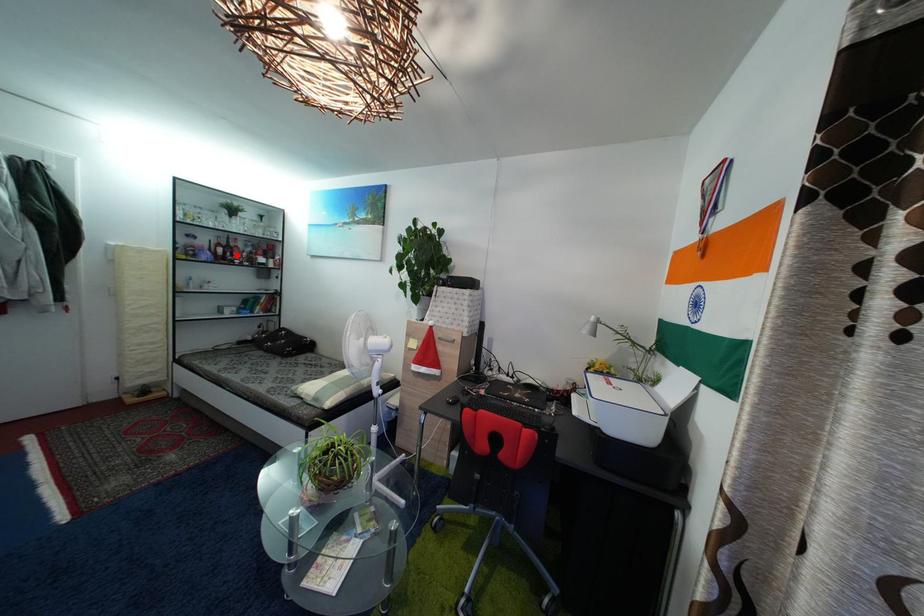
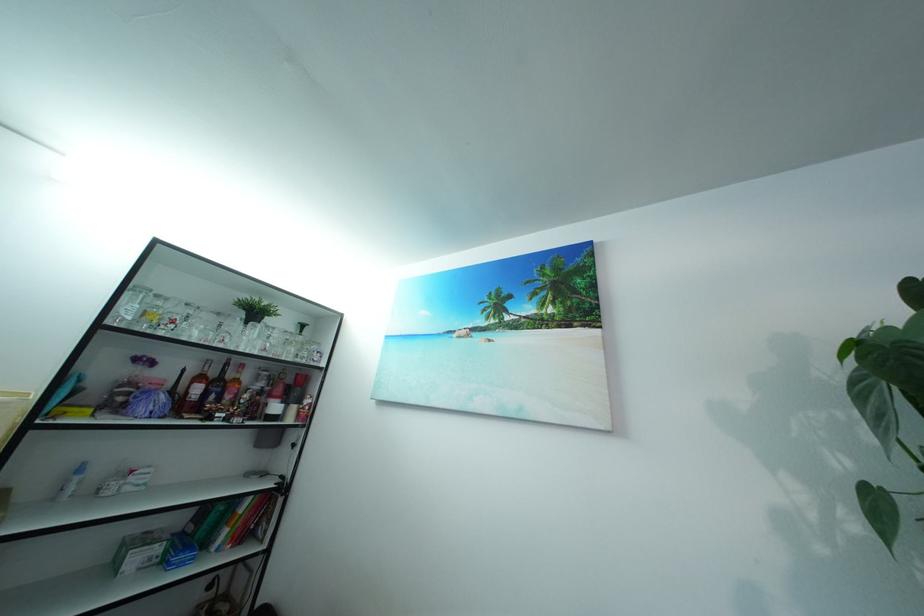
In the second image, find the point that corresponds to the highlighted location in the first image.

(226, 391)